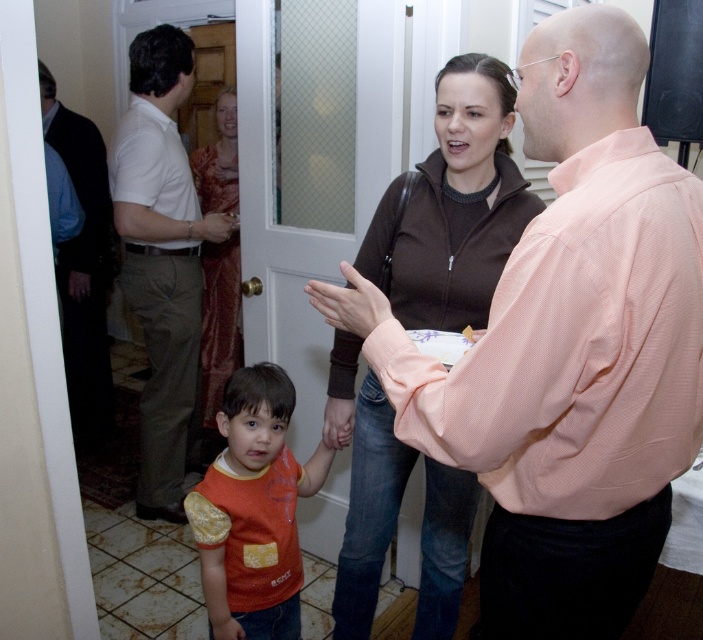
Is brown zip-up jacket at center smaller than matte plastic door handle at center?

No, brown zip-up jacket at center is not smaller than matte plastic door handle at center.

Can you confirm if brown zip-up jacket at center is positioned to the left of matte plastic door handle at center?

In fact, brown zip-up jacket at center is to the right of matte plastic door handle at center.

You are a GUI agent. You are given a task and a screenshot of the screen. Output one action in this format:
    pyautogui.click(x=<x>, y=<y>)
    Task: Click on the brown zip-up jacket at center
    The image size is (703, 640).
    Given the screenshot: What is the action you would take?
    pyautogui.click(x=451, y=205)

Is dark blue shirt at left bigger than matte orange shirt at lower left?

Yes, dark blue shirt at left is bigger than matte orange shirt at lower left.

Is point (70, 262) positioned after point (340, 424)?

Yes, point (70, 262) is farther from viewer.

This screenshot has height=640, width=703. Find the location of `dark blue shirt at left`. dark blue shirt at left is located at coordinates (83, 268).

Does silky red sari at door have a larger size compared to matte orange shirt at lower left?

Yes.

Is silky red sari at door wider than matte orange shirt at lower left?

Yes, silky red sari at door is wider than matte orange shirt at lower left.

Measure the distance between silky red sari at door and camera.

A distance of 8.59 feet exists between silky red sari at door and camera.

You are a GUI agent. You are given a task and a screenshot of the screen. Output one action in this format:
    pyautogui.click(x=<x>, y=<y>)
    Task: Click on the silky red sari at door
    The height and width of the screenshot is (640, 703).
    Given the screenshot: What is the action you would take?
    pyautogui.click(x=219, y=333)